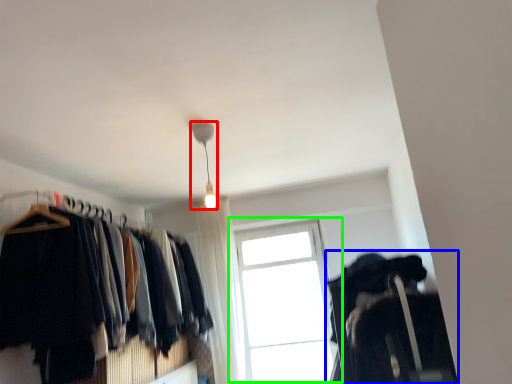
Question: Which object is positioned farthest from lamp (highlighted by a red box)? Select from closet (highlighted by a blue box) and window (highlighted by a green box).

Choices:
 (A) closet
 (B) window

Answer: (B)